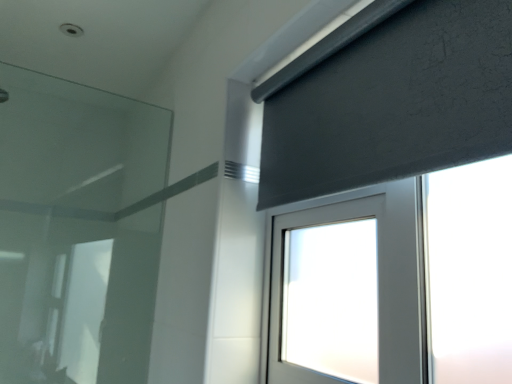
Question: Is transparent glass at left placed right next to dark gray textured curtain at upper right?

Choices:
 (A) no
 (B) yes

Answer: (A)

Question: Considering the relative sizes of transparent glass at left and dark gray textured curtain at upper right in the image provided, is transparent glass at left smaller than dark gray textured curtain at upper right?

Choices:
 (A) no
 (B) yes

Answer: (A)

Question: Is dark gray textured curtain at upper right at the back of transparent glass at left?

Choices:
 (A) yes
 (B) no

Answer: (B)

Question: From a real-world perspective, is transparent glass at left positioned over dark gray textured curtain at upper right based on gravity?

Choices:
 (A) yes
 (B) no

Answer: (B)

Question: Considering the relative sizes of transparent glass at left and dark gray textured curtain at upper right in the image provided, is transparent glass at left bigger than dark gray textured curtain at upper right?

Choices:
 (A) yes
 (B) no

Answer: (A)

Question: Is transparent glass at left shorter than dark gray textured curtain at upper right?

Choices:
 (A) yes
 (B) no

Answer: (B)

Question: From the image's perspective, is dark gray textured curtain at upper right on transparent glass at left?

Choices:
 (A) no
 (B) yes

Answer: (B)

Question: Can you see dark gray textured curtain at upper right touching transparent glass at left?

Choices:
 (A) yes
 (B) no

Answer: (B)

Question: Is dark gray textured curtain at upper right at the right side of transparent glass at left?

Choices:
 (A) no
 (B) yes

Answer: (B)

Question: Is dark gray textured curtain at upper right outside of transparent glass at left?

Choices:
 (A) no
 (B) yes

Answer: (B)

Question: Is dark gray textured curtain at upper right at the left side of transparent glass at left?

Choices:
 (A) no
 (B) yes

Answer: (A)

Question: Does dark gray textured curtain at upper right have a greater width compared to transparent glass at left?

Choices:
 (A) no
 (B) yes

Answer: (B)

Question: Would you say transparent glass at left is inside or outside dark gray textured curtain at upper right?

Choices:
 (A) inside
 (B) outside

Answer: (B)